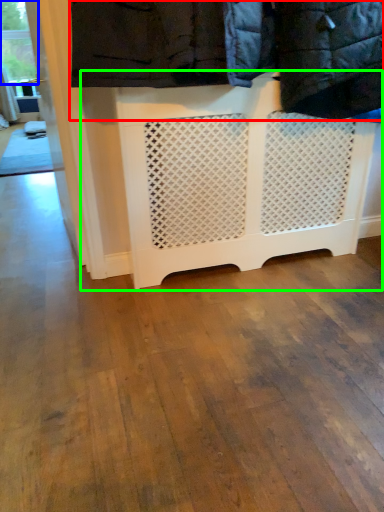
Question: Which object is positioned closest to laundry (highlighted by a red box)? Select from window frame (highlighted by a blue box) and furniture (highlighted by a green box).

Choices:
 (A) window frame
 (B) furniture

Answer: (B)